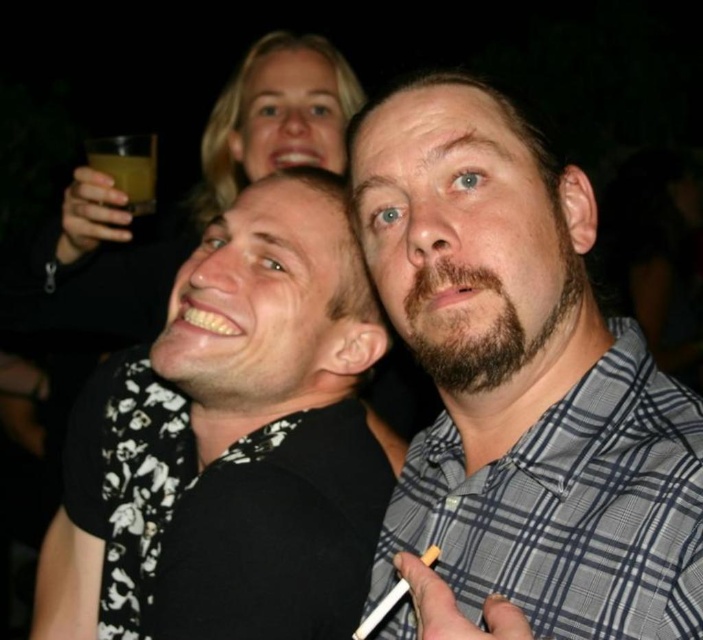
Question: Can you confirm if gray checkered shirt at center is positioned to the left of black floral shirt at center?

Choices:
 (A) yes
 (B) no

Answer: (B)

Question: Which of the following is the closest to the observer?

Choices:
 (A) (135, 156)
 (B) (489, 241)

Answer: (B)

Question: Is black floral shirt at center to the right of translucent amber liquid at upper left from the viewer's perspective?

Choices:
 (A) yes
 (B) no

Answer: (A)

Question: Which point appears closest to the camera in this image?

Choices:
 (A) (427, 509)
 (B) (116, 157)
 (C) (195, 428)

Answer: (A)

Question: Is gray checkered shirt at center below black floral shirt at center?

Choices:
 (A) yes
 (B) no

Answer: (B)

Question: Which object is the closest to the gray checkered shirt at center?

Choices:
 (A) black floral shirt at center
 (B) translucent amber liquid at upper left

Answer: (A)